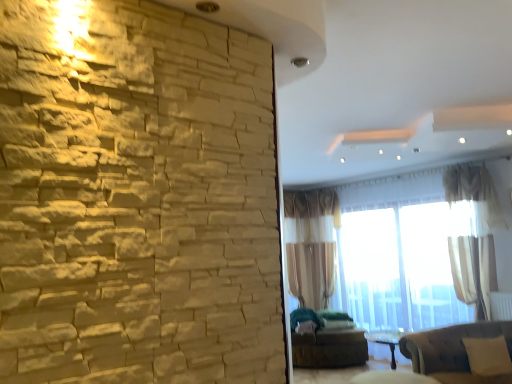
Question: From a real-world perspective, is beige fabric pillow at lower right physically below sheer beige curtain at center, which ranks as the 1th curtain in back-to-front order?

Choices:
 (A) no
 (B) yes

Answer: (B)

Question: Can you confirm if beige fabric pillow at lower right is shorter than sheer beige curtain at center, which appears as the 2th curtain when viewed from the right?

Choices:
 (A) no
 (B) yes

Answer: (B)

Question: Does beige fabric pillow at lower right have a larger size compared to sheer beige curtain at center, the 1th curtain positioned from the left?

Choices:
 (A) yes
 (B) no

Answer: (B)

Question: Does beige fabric pillow at lower right appear on the left side of sheer beige curtain at center, the 2th curtain in the front-to-back sequence?

Choices:
 (A) yes
 (B) no

Answer: (B)

Question: Is beige fabric pillow at lower right taller than sheer beige curtain at center, which appears as the 2th curtain when viewed from the right?

Choices:
 (A) yes
 (B) no

Answer: (B)

Question: Is brown fabric futon at lower center to the left or to the right of translucent fabric window at center in the image?

Choices:
 (A) right
 (B) left

Answer: (B)

Question: In terms of size, does brown fabric futon at lower center appear bigger or smaller than translucent fabric window at center?

Choices:
 (A) big
 (B) small

Answer: (B)

Question: From a real-world perspective, is brown fabric futon at lower center above or below translucent fabric window at center?

Choices:
 (A) above
 (B) below

Answer: (B)

Question: From the image's perspective, relative to translucent fabric window at center, is brown fabric futon at lower center above or below?

Choices:
 (A) below
 (B) above

Answer: (A)

Question: Is point (484, 301) positioned closer to the camera than point (466, 337)?

Choices:
 (A) closer
 (B) farther

Answer: (B)

Question: Considering the positions of translucent fabric window at center and velvet brown couch at lower right in the image, is translucent fabric window at center wider or thinner than velvet brown couch at lower right?

Choices:
 (A) thin
 (B) wide

Answer: (A)

Question: From the image's perspective, is translucent fabric window at center located above or below velvet brown couch at lower right?

Choices:
 (A) above
 (B) below

Answer: (A)

Question: From a real-world perspective, relative to velvet brown couch at lower right, is translucent fabric window at center vertically above or below?

Choices:
 (A) below
 (B) above

Answer: (B)

Question: Is white plastic radiator at lower right in front of or behind white sheer curtain at upper right, marked as the 2th curtain in a back-to-front arrangement, in the image?

Choices:
 (A) front
 (B) behind

Answer: (B)

Question: Based on their positions, is white plastic radiator at lower right located to the left or right of white sheer curtain at upper right, marked as the 1th curtain in a front-to-back arrangement?

Choices:
 (A) right
 (B) left

Answer: (A)